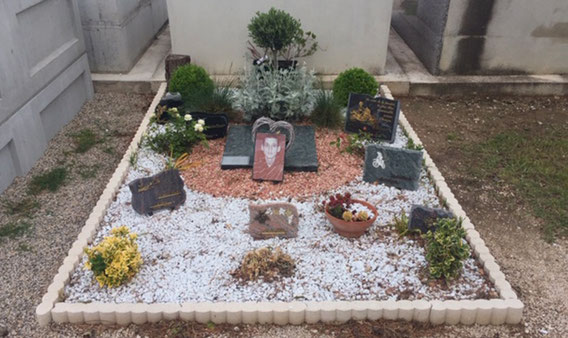
The height and width of the screenshot is (338, 568). I want to click on wall, so click(328, 46).